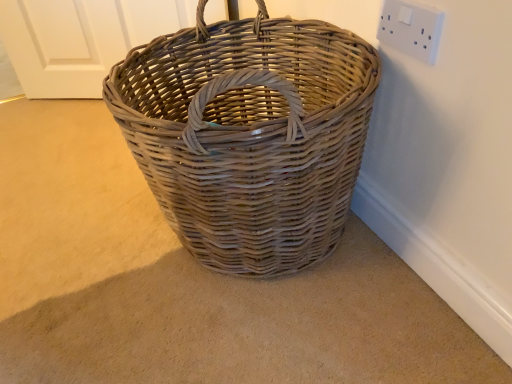
Identify the location of vacant space situated on the left part of natural wicker picnic basket at center. The height and width of the screenshot is (384, 512). (74, 227).